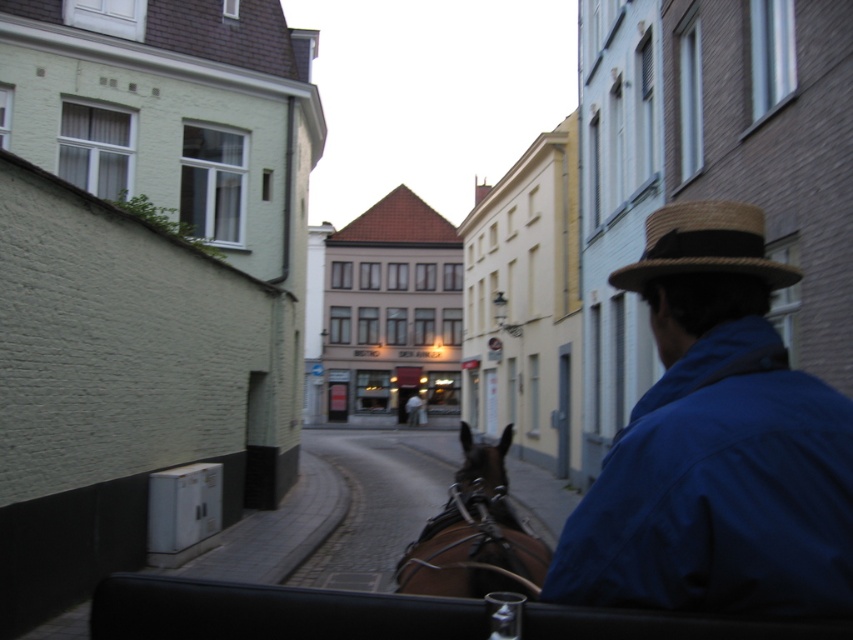
Who is more forward, [689,317] or [747,266]?

Point [747,266] is in front.

Does blue cotton jacket at right appear on the right side of natural straw hat at upper right?

Incorrect, blue cotton jacket at right is not on the right side of natural straw hat at upper right.

You are a GUI agent. You are given a task and a screenshot of the screen. Output one action in this format:
    pyautogui.click(x=<x>, y=<y>)
    Task: Click on the blue cotton jacket at right
    
    Given the screenshot: What is the action you would take?
    pyautogui.click(x=717, y=445)

Locate an element on the screen. Image resolution: width=853 pixels, height=640 pixels. blue cotton jacket at right is located at coordinates (717, 445).

Can you confirm if blue cotton jacket at right is positioned to the right of brown leather horse at center?

Incorrect, blue cotton jacket at right is not on the right side of brown leather horse at center.

Is blue cotton jacket at right below brown leather horse at center?

No.

Is point (772, 557) positioned after point (486, 500)?

No, it is not.

Image resolution: width=853 pixels, height=640 pixels. Find the location of `blue cotton jacket at right`. blue cotton jacket at right is located at coordinates (717, 445).

Where is `brown leather horse at center`? This screenshot has height=640, width=853. brown leather horse at center is located at coordinates (474, 534).

Can you confirm if brown leather horse at center is positioned below natural straw hat at upper right?

Yes, brown leather horse at center is below natural straw hat at upper right.

Which is behind, point (543, 561) or point (680, 250)?

The point (543, 561) is behind.

In order to click on brown leather horse at center in this screenshot , I will do point(474,534).